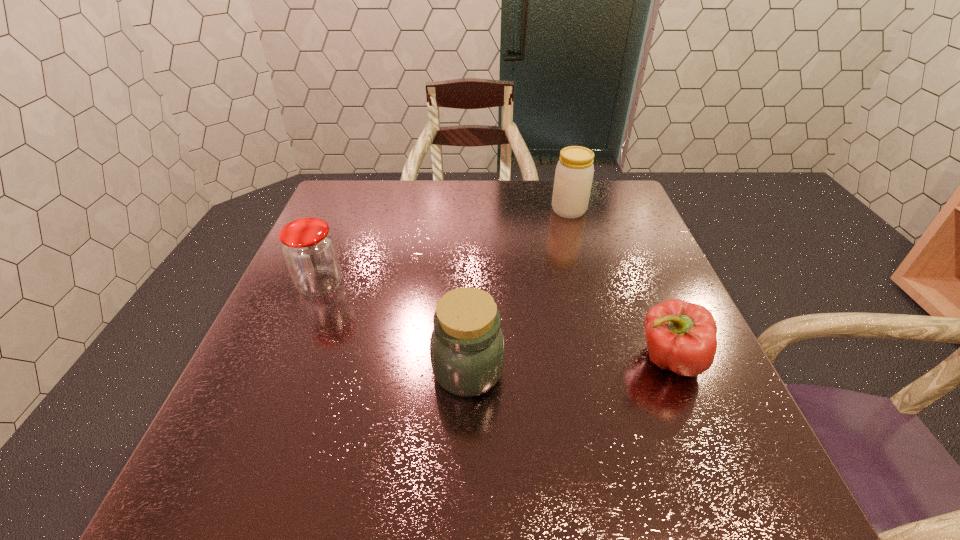
In order to click on vacant space at the far left corner of the desktop in this screenshot , I will do (x=330, y=201).

Image resolution: width=960 pixels, height=540 pixels. Find the location of `vacant region at the near left corner`. vacant region at the near left corner is located at coordinates (268, 469).

At what (x,y) coordinates should I click in order to perform the action: click on free space at the far right corner of the desktop. Please return your answer as a coordinate pair (x, y). The width and height of the screenshot is (960, 540). Looking at the image, I should click on (631, 194).

You are a GUI agent. You are given a task and a screenshot of the screen. Output one action in this format:
    pyautogui.click(x=<x>, y=<y>)
    Task: Click on the vacant space at the near right corner of the desktop
    
    Given the screenshot: What is the action you would take?
    pyautogui.click(x=700, y=494)

What are the coordinates of `vacant area that lies between the rightmost jar and the shortest object` in the screenshot? It's located at (619, 285).

Identify the location of vacant area that lies between the farthest object and the bell pepper. (619, 285).

Where is `empty location between the nearest jar and the shortest object`? This screenshot has height=540, width=960. empty location between the nearest jar and the shortest object is located at coordinates (568, 365).

I want to click on free space between the leftmost jar and the farthest object, so click(x=444, y=248).

Where is `free area in between the shortest object and the nearest jar`? The height and width of the screenshot is (540, 960). free area in between the shortest object and the nearest jar is located at coordinates (568, 365).

You are a GUI agent. You are given a task and a screenshot of the screen. Output one action in this format:
    pyautogui.click(x=<x>, y=<y>)
    Task: Click on the free space between the leftmost jar and the farthest jar
    
    Given the screenshot: What is the action you would take?
    pyautogui.click(x=444, y=248)